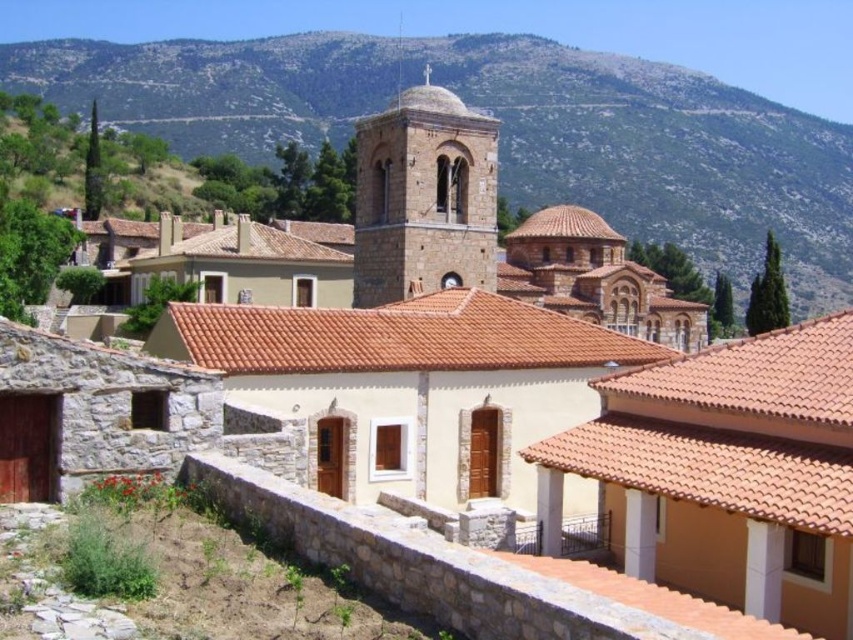
Does green rocky mountain at upper center lie in front of brown stone tower at center?

That is False.

Is point (309, 104) positioned after point (491, 211)?

Yes.

At what (x,y) coordinates should I click in order to perform the action: click on green rocky mountain at upper center. Please return your answer as a coordinate pair (x, y). Image resolution: width=853 pixels, height=640 pixels. Looking at the image, I should click on (660, 154).

Who is lower down, green rocky mountain at upper center or terracotta tile roof at center?

terracotta tile roof at center

Does green rocky mountain at upper center have a greater height compared to terracotta tile roof at center?

Indeed, green rocky mountain at upper center has a greater height compared to terracotta tile roof at center.

Identify the location of green rocky mountain at upper center. (660, 154).

At what (x,y) coordinates should I click in order to perform the action: click on terracotta tile roof at center. Please return your answer as a coordinate pair (x, y). This screenshot has width=853, height=640. Looking at the image, I should click on (401, 337).

Between terracotta tile roof at center and brown stone tower at center, which one has more height?

Standing taller between the two is brown stone tower at center.

Measure the distance between point (456, 353) and camera.

Point (456, 353) and camera are 111.82 feet apart.

Locate an element on the screen. The height and width of the screenshot is (640, 853). terracotta tile roof at center is located at coordinates (401, 337).